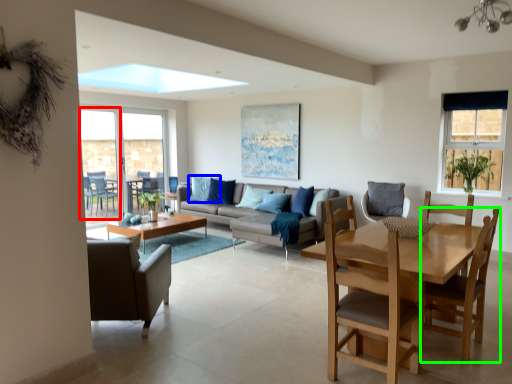
Question: Based on their relative distances, which object is farther from screen door (highlighted by a red box)? Choose from pillow (highlighted by a blue box) and chair (highlighted by a green box).

Choices:
 (A) pillow
 (B) chair

Answer: (B)